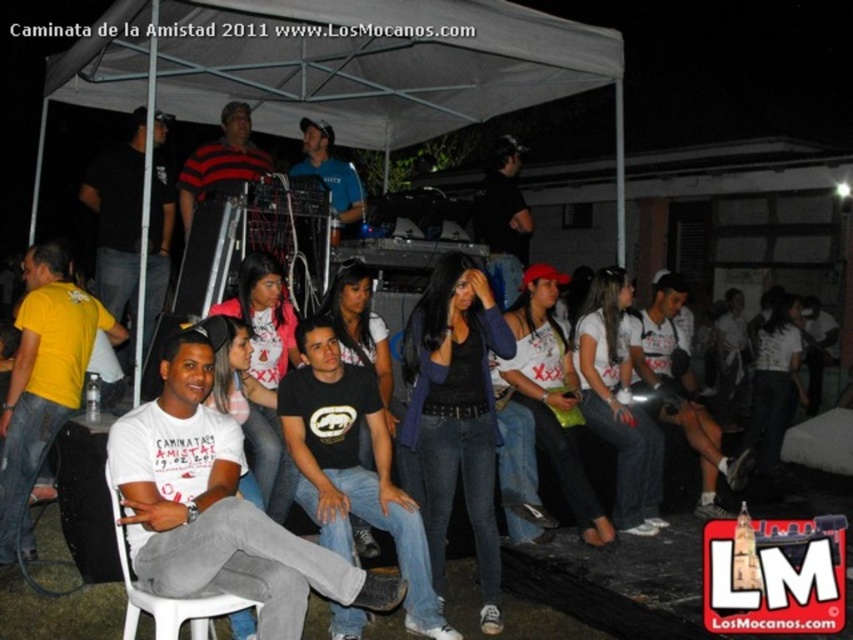
The width and height of the screenshot is (853, 640). I want to click on white cotton t-shirt at center, so click(x=216, y=508).

Is white cotton t-shirt at center closer to camera compared to matte yellow t-shirt at lower left?

Yes, it is in front of matte yellow t-shirt at lower left.

The height and width of the screenshot is (640, 853). I want to click on white cotton t-shirt at center, so pyautogui.click(x=216, y=508).

The height and width of the screenshot is (640, 853). I want to click on white cotton t-shirt at center, so click(216, 508).

Looking at this image, which is more to the left, white cotton t-shirt at center or denim jeans at center?

From the viewer's perspective, white cotton t-shirt at center appears more on the left side.

Is point (264, 636) in front of point (454, 445)?

Yes, it is in front of point (454, 445).

Where is `white cotton t-shirt at center`? This screenshot has width=853, height=640. white cotton t-shirt at center is located at coordinates (216, 508).

Who is lower down, denim jeans at center or white plastic chair at lower left?

white plastic chair at lower left is lower down.

Which is behind, point (410, 372) or point (260, 500)?

The point (410, 372) is more distant.

Which is behind, point (471, 422) or point (114, 525)?

The point (471, 422) is more distant.

The height and width of the screenshot is (640, 853). Find the location of `denim jeans at center`. denim jeans at center is located at coordinates click(456, 412).